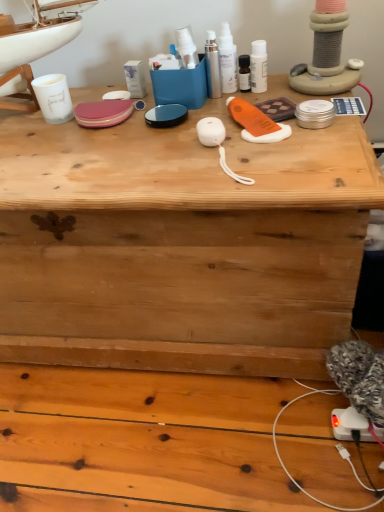
This screenshot has height=512, width=384. What are the coordinates of `vacant area that is situated to the right of white glossy spray bottles at upper center, acting as the second toiletry starting from the right` in the screenshot? It's located at (288, 89).